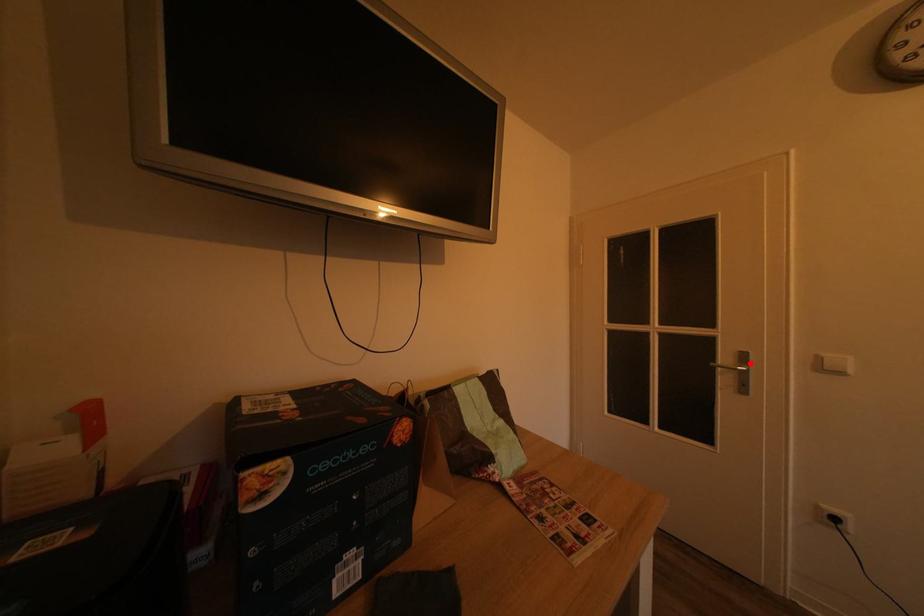
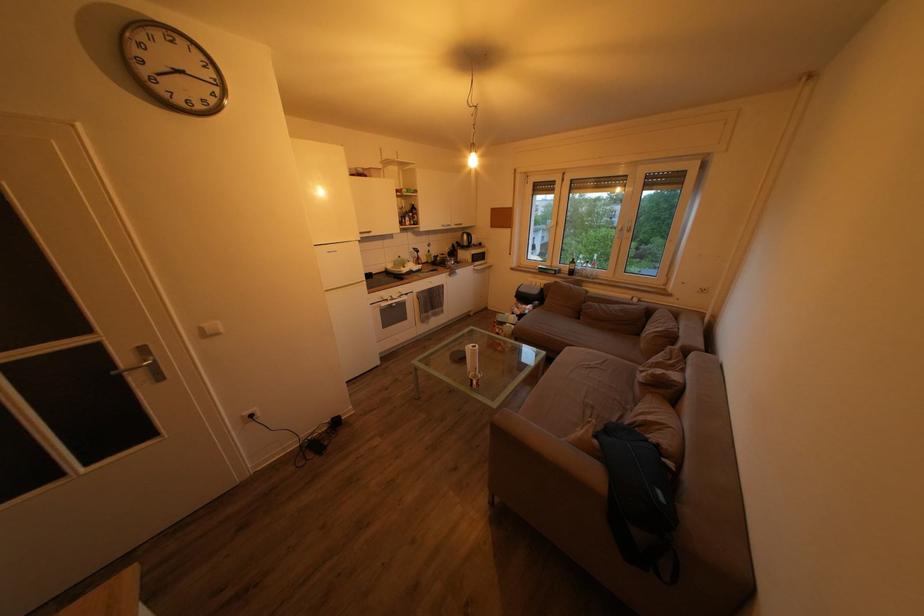
Find the pixel in the second image that matches the highlighted location in the first image.

(151, 357)